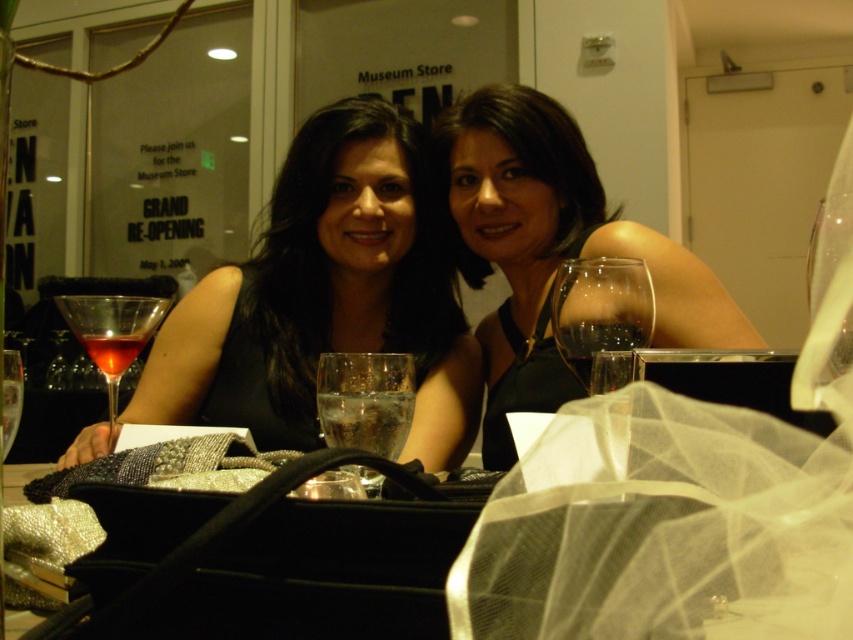
Does black satin dress at center have a lesser width compared to translucent glass martini at left?

Incorrect, black satin dress at center's width is not less than translucent glass martini at left's.

Between point (509, 436) and point (83, 326), which one is positioned in front?

Point (83, 326)

Where is `black satin dress at center`? Image resolution: width=853 pixels, height=640 pixels. black satin dress at center is located at coordinates (549, 248).

Between transparent glass at center and translucent glass wine at center, which one appears on the right side from the viewer's perspective?

transparent glass at center is more to the right.

Is point (554, 337) closer to viewer compared to point (97, 362)?

Yes, point (554, 337) is in front of point (97, 362).

Is point (555, 330) behind point (120, 365)?

That is False.

Locate an element on the screen. This screenshot has height=640, width=853. transparent glass at center is located at coordinates (601, 308).

Does clear glass at center have a smaller size compared to translucent glass wine at center?

Indeed, clear glass at center has a smaller size compared to translucent glass wine at center.

Which is more to the right, clear glass at center or translucent glass wine at center?

From the viewer's perspective, clear glass at center appears more on the right side.

Between point (592, 320) and point (119, 349), which one is positioned in front?

Positioned in front is point (592, 320).

Locate an element on the screen. This screenshot has height=640, width=853. clear glass at center is located at coordinates [595, 342].